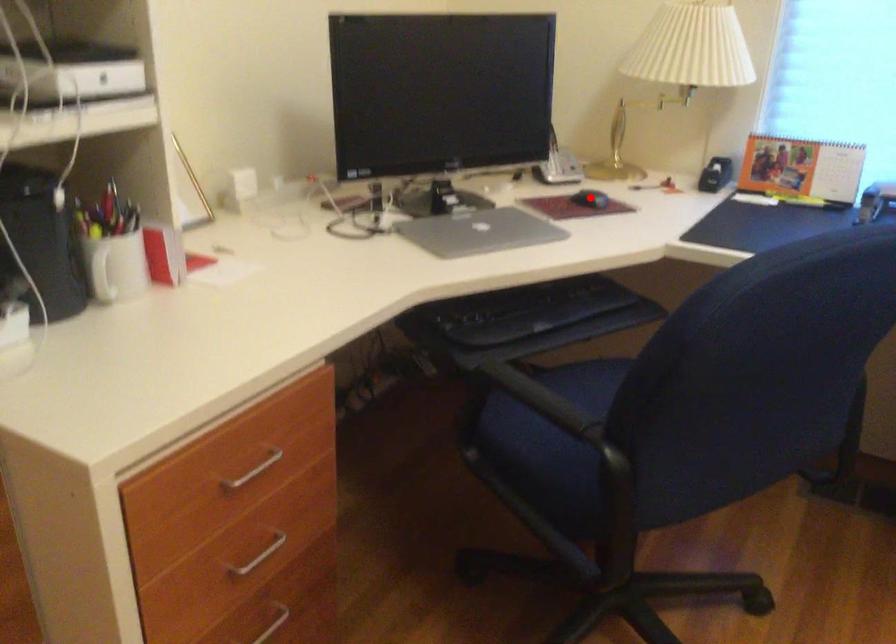
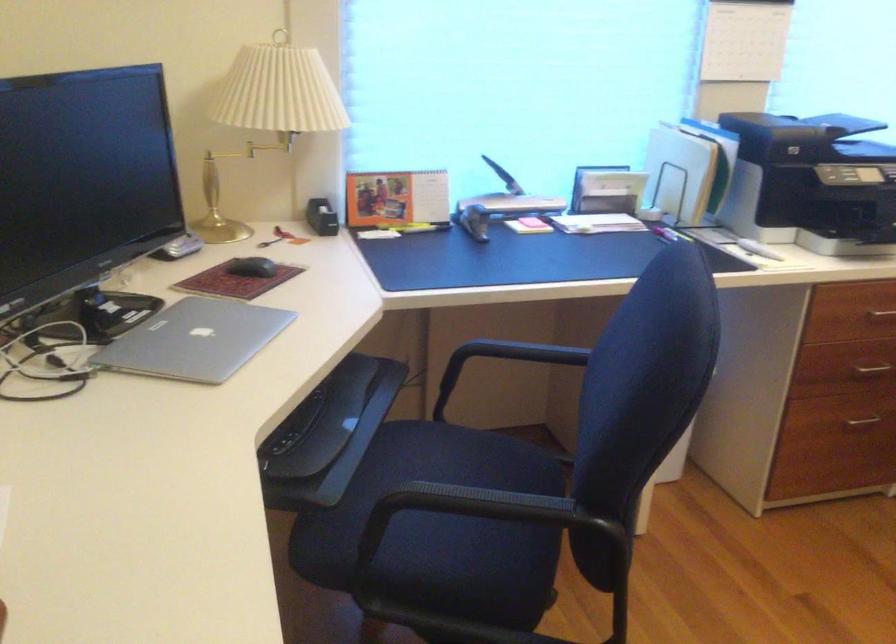
In the second image, find the point that corresponds to the highlighted location in the first image.

(252, 267)